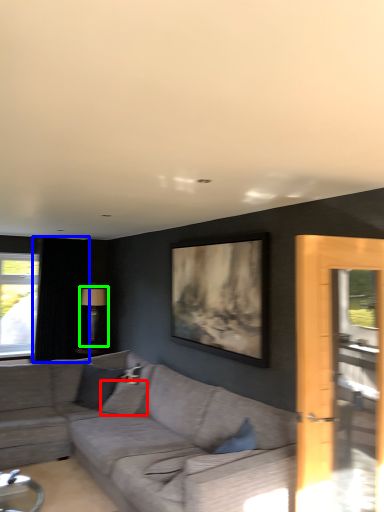
Question: Considering the real-world distances, which object is farthest from pillow (highlighted by a red box)? curtain (highlighted by a blue box) or lamp (highlighted by a green box)?

Choices:
 (A) curtain
 (B) lamp

Answer: (A)